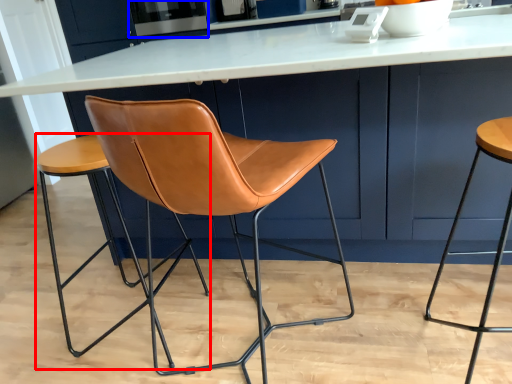
Question: Which point is closer to the camera, stool (highlighted by a red box) or appliance (highlighted by a blue box)?

Choices:
 (A) stool
 (B) appliance

Answer: (A)